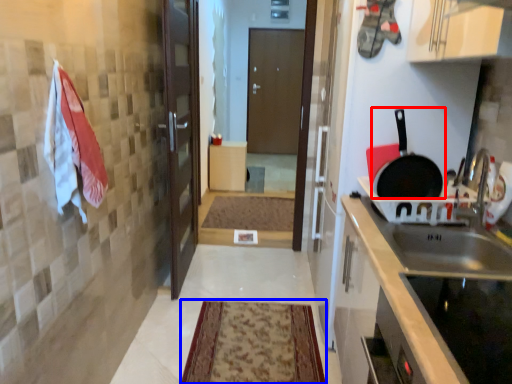
Question: Which object is closer to the camera taking this photo, frying pan (highlighted by a red box) or mat (highlighted by a blue box)?

Choices:
 (A) frying pan
 (B) mat

Answer: (A)